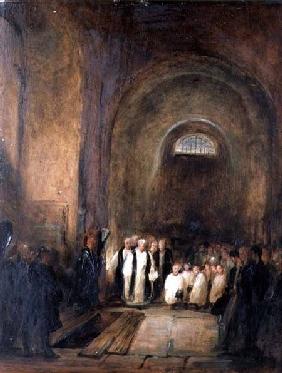
Find the location of a particular element. large wooden door is located at coordinates (193, 193).